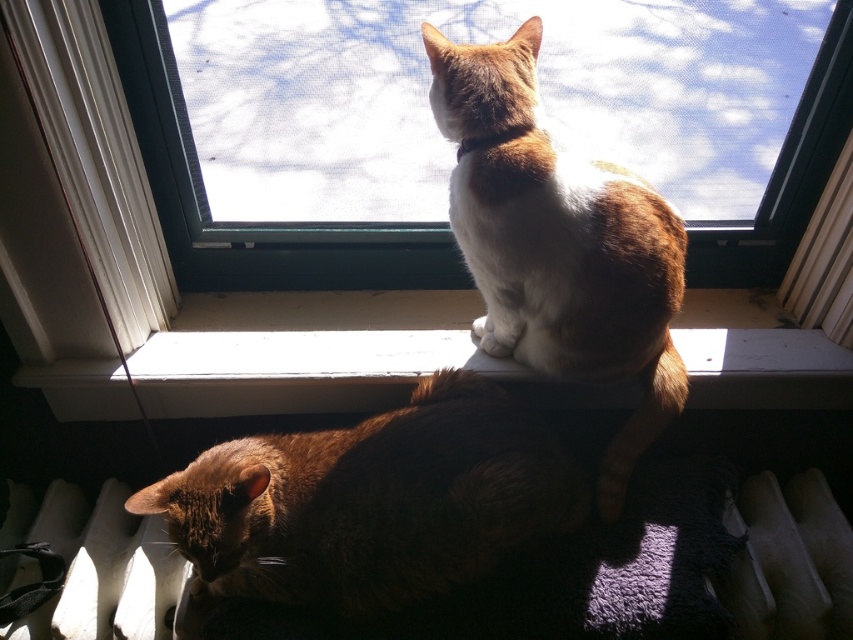
Question: Based on their relative distances, which object is farther from the dark brown fur cat at lower center?

Choices:
 (A) white smooth window sill at center
 (B) white soft fur cat at upper center
 (C) transparent glass window at upper center

Answer: (B)

Question: Can you confirm if transparent glass window at upper center is positioned below white smooth window sill at center?

Choices:
 (A) yes
 (B) no

Answer: (B)

Question: Observing the image, what is the correct spatial positioning of transparent glass window at upper center in reference to dark brown fur cat at lower center?

Choices:
 (A) above
 (B) below

Answer: (A)

Question: Does dark brown fur cat at lower center appear on the left side of white soft fur cat at upper center?

Choices:
 (A) yes
 (B) no

Answer: (A)

Question: Which object is the closest to the white smooth window sill at center?

Choices:
 (A) dark brown fur cat at lower center
 (B) white soft fur cat at upper center

Answer: (A)

Question: Which of the following is the farthest from the observer?

Choices:
 (A) transparent glass window at upper center
 (B) white soft fur cat at upper center

Answer: (B)